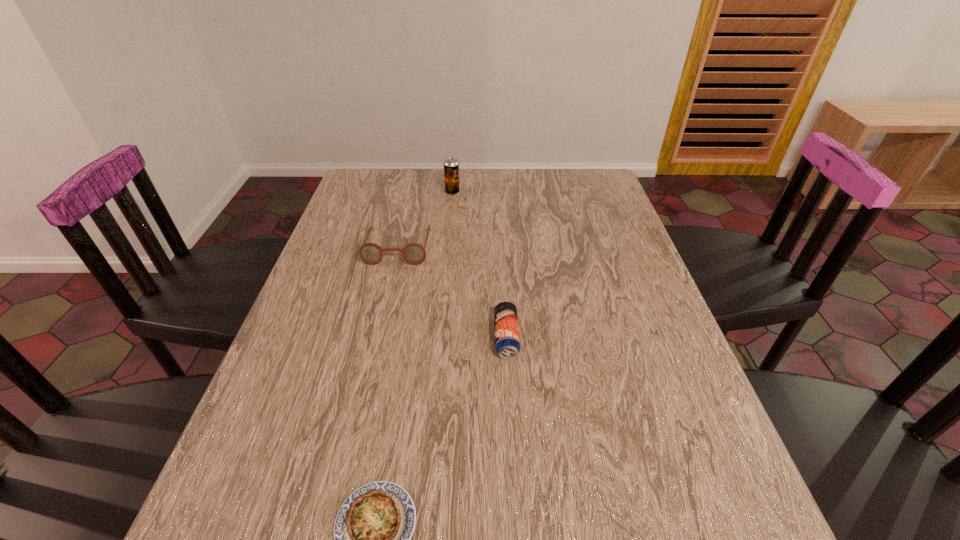
At what (x,y) coordinates should I click in order to perform the action: click on vacant area that lies between the left beer can and the third shortest object. Please return your answer as a coordinate pair (x, y). This screenshot has width=960, height=540. Looking at the image, I should click on (425, 219).

Identify which object is the third nearest to the farther beer can. Please provide its 2D coordinates. Your answer should be formatted as a tuple, i.e. [(x, y)], where the tuple contains the x and y coordinates of a point satisfying the conditions above.

[(373, 527)]

Point out which object is positioned as the third nearest to the right beer can. Please provide its 2D coordinates. Your answer should be formatted as a tuple, i.e. [(x, y)], where the tuple contains the x and y coordinates of a point satisfying the conditions above.

[(451, 166)]

At what (x,y) coordinates should I click in order to perform the action: click on vacant area that satisfies the following two spatial constraints: 1. on the front-facing side of the right beer can; 2. on the right side of the second tallest object. Please return your answer as a coordinate pair (x, y). Image resolution: width=960 pixels, height=540 pixels. Looking at the image, I should click on (377, 338).

Locate an element on the screen. The image size is (960, 540). vacant space that satisfies the following two spatial constraints: 1. on the front-facing side of the rightmost object; 2. on the right side of the third shortest object is located at coordinates (377, 338).

This screenshot has width=960, height=540. What are the coordinates of `vacant space that satisfies the following two spatial constraints: 1. on the front-facing side of the right beer can; 2. on the right side of the third nearest object` in the screenshot? It's located at (377, 338).